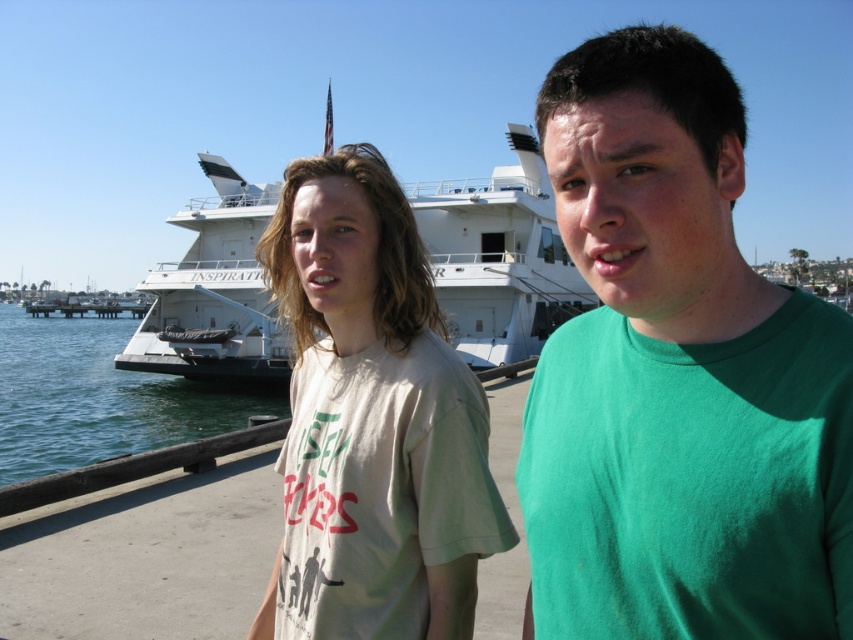
Question: Does green matte shirt at center have a greater width compared to light beige t-shirt at center?

Choices:
 (A) yes
 (B) no

Answer: (B)

Question: Which of these objects is positioned farthest from the clear blue water at lower left?

Choices:
 (A) white glossy yacht at upper center
 (B) light beige t-shirt at center
 (C) green matte shirt at center

Answer: (C)

Question: Which object appears closest to the camera in this image?

Choices:
 (A) green matte shirt at center
 (B) white glossy yacht at upper center
 (C) light beige t-shirt at center
 (D) clear blue water at lower left

Answer: (A)

Question: Which of the following is the closest to the observer?

Choices:
 (A) white glossy yacht at upper center
 (B) clear blue water at lower left
 (C) green matte shirt at center

Answer: (C)

Question: Is white glossy yacht at upper center below clear blue water at lower left?

Choices:
 (A) no
 (B) yes

Answer: (A)

Question: Where is white glossy yacht at upper center located in relation to clear blue water at lower left in the image?

Choices:
 (A) above
 (B) below

Answer: (A)